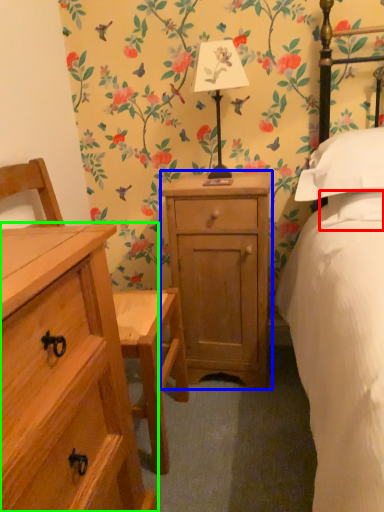
Question: Which object is the farthest from pillow (highlighted by a red box)? Choose among these: nightstand (highlighted by a blue box) or chest of drawers (highlighted by a green box).

Choices:
 (A) nightstand
 (B) chest of drawers

Answer: (B)